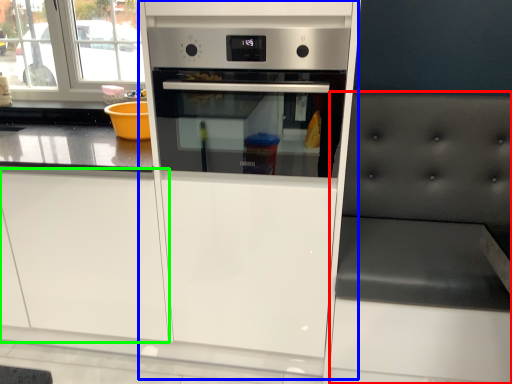
Question: Which is farther away from chair (highlighted by a red box)? fridge (highlighted by a blue box) or drawer (highlighted by a green box)?

Choices:
 (A) fridge
 (B) drawer

Answer: (B)